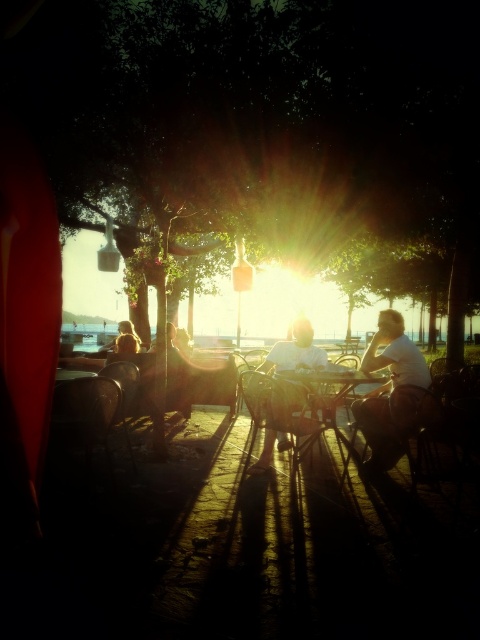
You are a guest at this outdoor dining area and want to sit down. The metallic silver table at center is your target. Is the metallic silver chair at lower left suitable for you to use with that table?

The metallic silver chair at lower left is smaller than the metallic silver table at center, so it may be less comfortable or proportionally mismatched for use with the table.

You are standing in the outdoor setting looking at the scene. There are two points marked in the image, point (x=282, y=362) and point (x=130, y=328). Which point is nearer to you?

Point (x=282, y=362) is closer to the viewer than point (x=130, y=328).